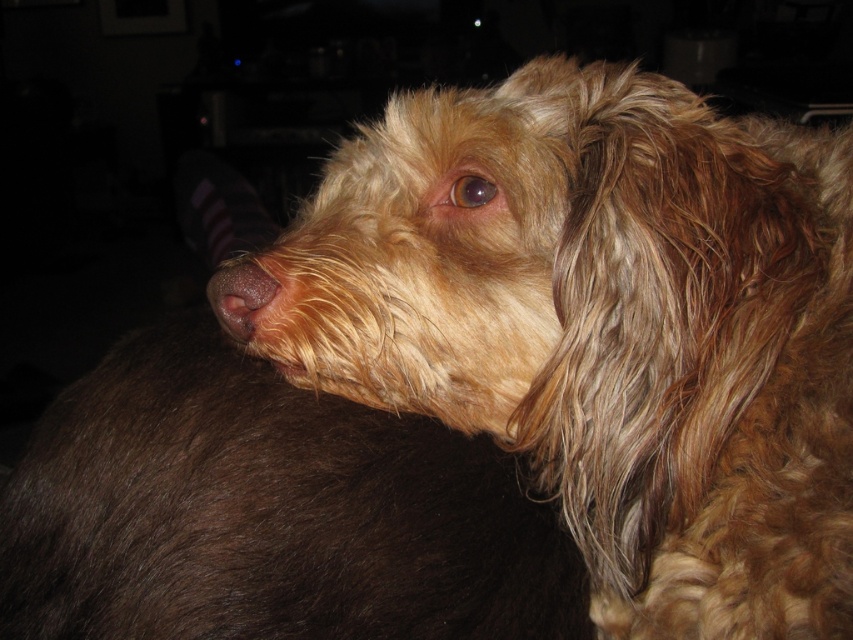
Question: Which point is farther to the camera?

Choices:
 (A) brown matte nose at center
 (B) fuzzy brown dog at center

Answer: (A)

Question: Does fuzzy brown dog at center come in front of brown fur eye at center?

Choices:
 (A) no
 (B) yes

Answer: (B)

Question: Which point is closer to the camera taking this photo?

Choices:
 (A) (790, 433)
 (B) (218, 282)

Answer: (A)

Question: Is brown matte nose at center to the right of brown fur eye at center from the viewer's perspective?

Choices:
 (A) no
 (B) yes

Answer: (A)

Question: Is fuzzy brown dog at center bigger than brown matte nose at center?

Choices:
 (A) yes
 (B) no

Answer: (A)

Question: Which object is closer to the camera taking this photo?

Choices:
 (A) brown matte nose at center
 (B) fuzzy brown dog at center
 (C) brown fur eye at center

Answer: (B)